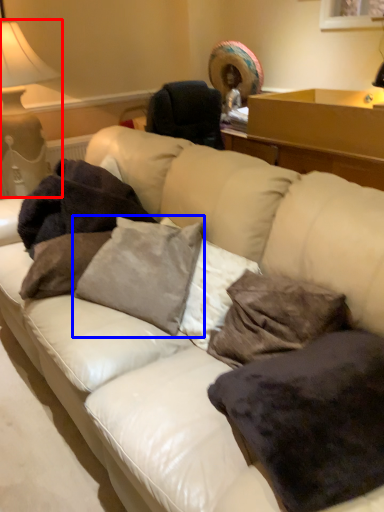
Question: Which object appears farthest to the camera in this image, table lamp (highlighted by a red box) or pillow (highlighted by a blue box)?

Choices:
 (A) table lamp
 (B) pillow

Answer: (A)